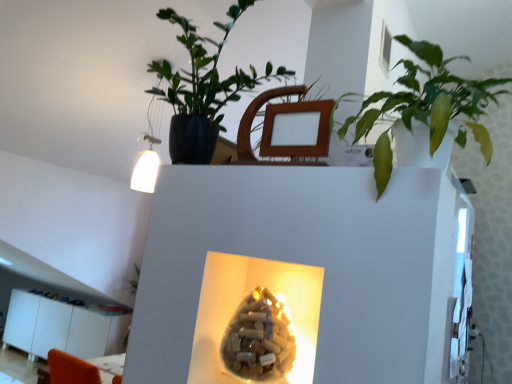
Question: Is the position of translucent beige vase at center more distant than that of matte black pot at upper center, which appears as the second houseplant when viewed from the right?

Choices:
 (A) yes
 (B) no

Answer: (B)

Question: From a real-world perspective, is translucent beige vase at center under matte black pot at upper center, the first houseplant when ordered from left to right?

Choices:
 (A) no
 (B) yes

Answer: (B)

Question: Is matte black pot at upper center, which appears as the second houseplant when viewed from the right, surrounded by translucent beige vase at center?

Choices:
 (A) yes
 (B) no

Answer: (B)

Question: Can you confirm if translucent beige vase at center is wider than matte black pot at upper center, the first houseplant when ordered from left to right?

Choices:
 (A) yes
 (B) no

Answer: (B)

Question: Does translucent beige vase at center have a lesser width compared to matte black pot at upper center, which appears as the second houseplant when viewed from the right?

Choices:
 (A) no
 (B) yes

Answer: (B)

Question: Considering the positions of point (183, 23) and point (365, 102), is point (183, 23) closer or farther from the camera than point (365, 102)?

Choices:
 (A) closer
 (B) farther

Answer: (B)

Question: Is matte black pot at upper center, the first houseplant when ordered from left to right, to the left or to the right of green glossy leafy plant at upper right, marked as the second houseplant in a left-to-right arrangement, in the image?

Choices:
 (A) left
 (B) right

Answer: (A)

Question: From a real-world perspective, is matte black pot at upper center, the first houseplant when ordered from left to right, positioned above or below green glossy leafy plant at upper right, marked as the second houseplant in a left-to-right arrangement?

Choices:
 (A) below
 (B) above

Answer: (B)

Question: Is matte black pot at upper center, the first houseplant when ordered from left to right, spatially inside green glossy leafy plant at upper right, marked as the second houseplant in a left-to-right arrangement, or outside of it?

Choices:
 (A) outside
 (B) inside

Answer: (A)

Question: Is wooden swivel chair at upper center inside the boundaries of translucent beige vase at center, or outside?

Choices:
 (A) inside
 (B) outside

Answer: (B)

Question: From the image's perspective, is wooden swivel chair at upper center above or below translucent beige vase at center?

Choices:
 (A) below
 (B) above

Answer: (B)

Question: Based on their positions, is wooden swivel chair at upper center located to the left or right of translucent beige vase at center?

Choices:
 (A) left
 (B) right

Answer: (B)

Question: In the image, is wooden swivel chair at upper center positioned in front of or behind translucent beige vase at center?

Choices:
 (A) behind
 (B) front

Answer: (A)

Question: From their relative heights in the image, would you say green glossy leafy plant at upper right, marked as the second houseplant in a left-to-right arrangement, is taller or shorter than wooden swivel chair at upper center?

Choices:
 (A) short
 (B) tall

Answer: (B)

Question: From the image's perspective, is green glossy leafy plant at upper right, marked as the second houseplant in a left-to-right arrangement, positioned above or below wooden swivel chair at upper center?

Choices:
 (A) below
 (B) above

Answer: (A)